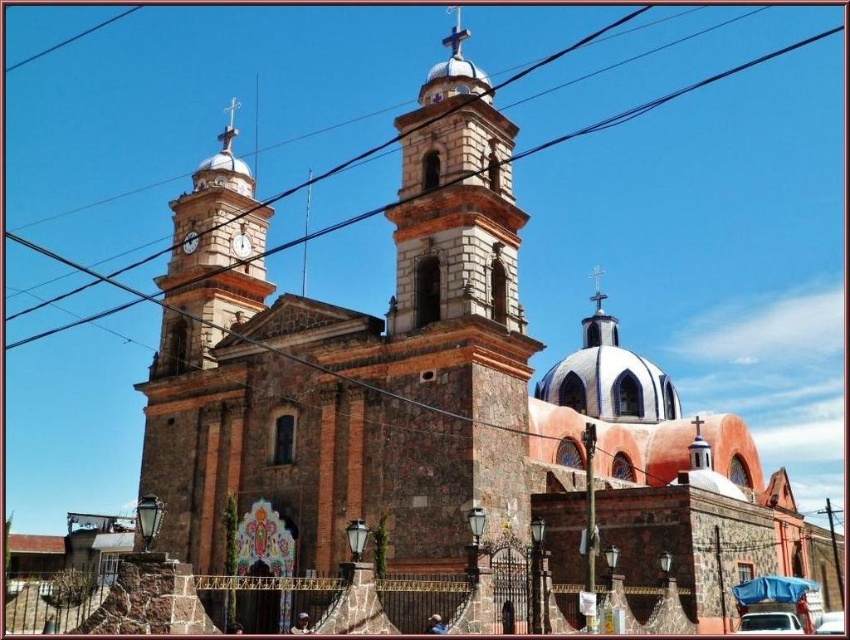
Is brick clock tower at left smaller than matte white clock at upper center?

No.

Between point (255, 262) and point (248, 252), which one is positioned behind?

Positioned behind is point (248, 252).

Find the location of `brick clock tower at left`. brick clock tower at left is located at coordinates (211, 260).

Does brick clock tower at left have a greater height compared to white matte car at lower right?

Yes.

Can you confirm if brick clock tower at left is smaller than white matte car at lower right?

No, brick clock tower at left is not smaller than white matte car at lower right.

At what (x,y) coordinates should I click in order to perform the action: click on brick clock tower at left. Please return your answer as a coordinate pair (x, y). The image size is (850, 640). Looking at the image, I should click on (211, 260).

What do you see at coordinates (769, 621) in the screenshot? I see `white matte car at lower right` at bounding box center [769, 621].

Can you confirm if white matte car at lower right is smaller than white plastic car at lower right?

Yes.

Image resolution: width=850 pixels, height=640 pixels. What do you see at coordinates (769, 621) in the screenshot?
I see `white matte car at lower right` at bounding box center [769, 621].

Locate an element on the screen. Image resolution: width=850 pixels, height=640 pixels. white matte car at lower right is located at coordinates (769, 621).